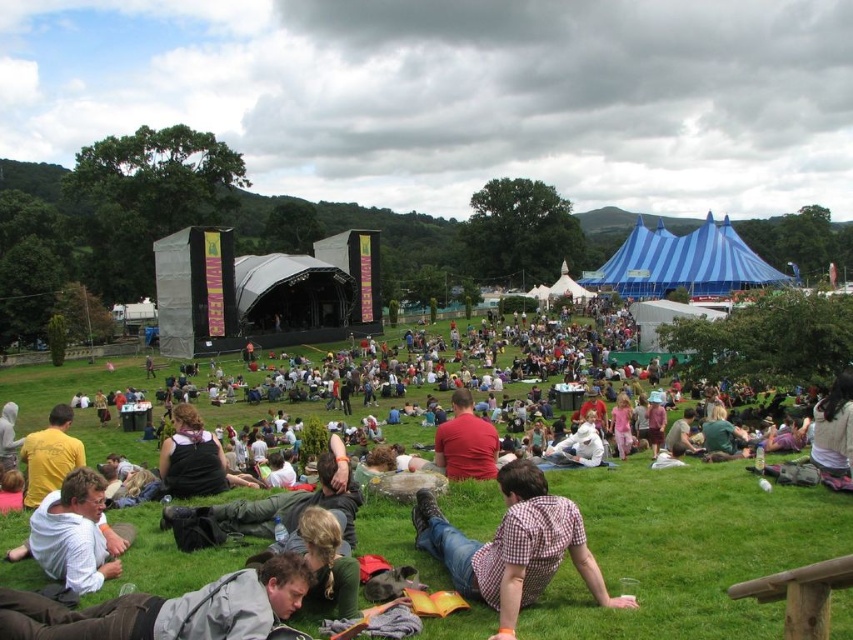
Question: Which point is closer to the camera?

Choices:
 (A) (509, 472)
 (B) (750, 508)
 (C) (44, 568)
 (D) (479, 440)

Answer: (C)

Question: Which of the following is the farthest from the observer?

Choices:
 (A) (438, 436)
 (B) (216, 556)
 (C) (61, 520)

Answer: (A)

Question: Which of these objects is positioned farthest from the red matte shirt at center?

Choices:
 (A) white cotton shirt at lower left
 (B) plaid shirt at center

Answer: (A)

Question: Is plaid shirt at center below gray fabric jacket at lower left?

Choices:
 (A) no
 (B) yes

Answer: (A)

Question: Is gray fabric jacket at lower left above red matte shirt at center?

Choices:
 (A) yes
 (B) no

Answer: (B)

Question: Can you confirm if gray fabric jacket at lower left is positioned to the left of red matte shirt at center?

Choices:
 (A) no
 (B) yes

Answer: (B)